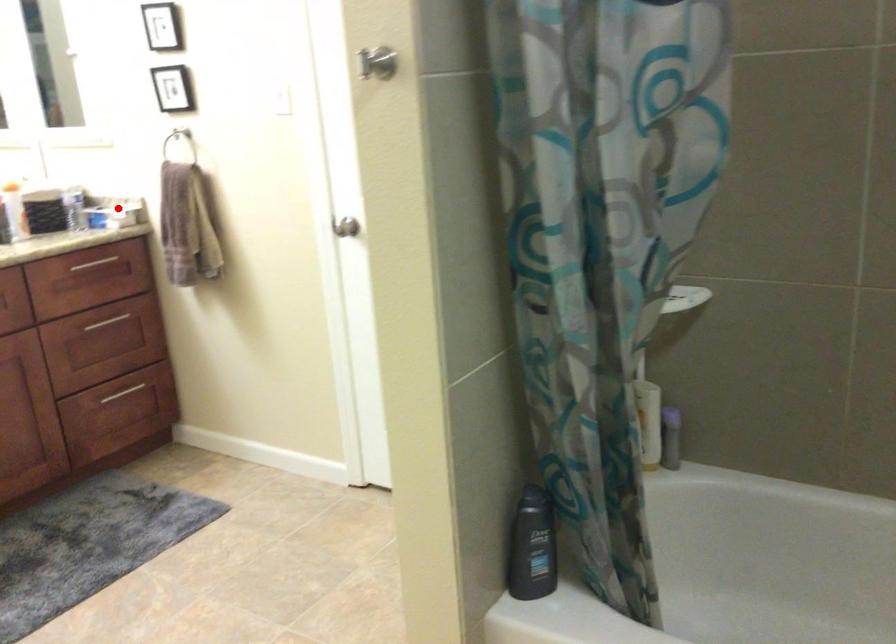
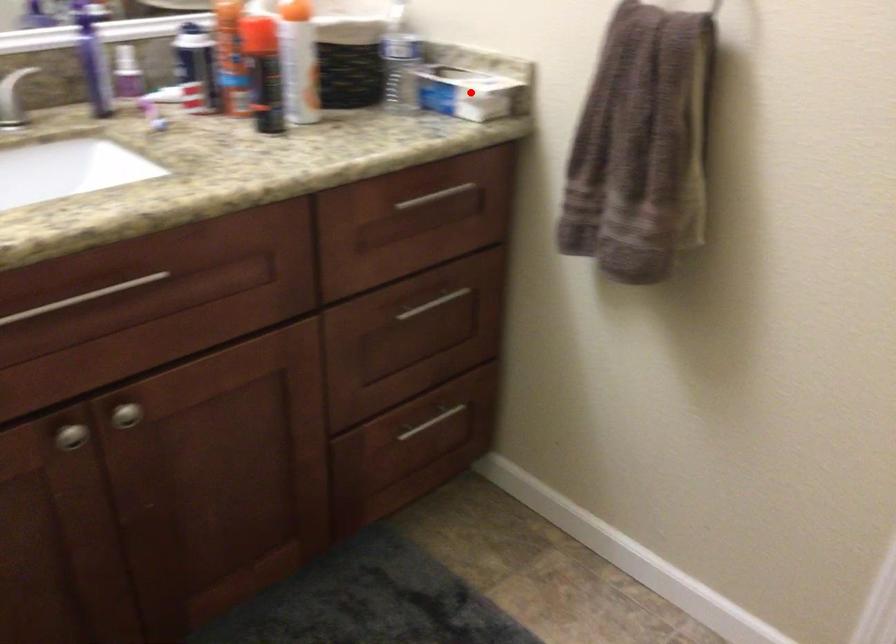
I am providing you with two images of the same scene from different viewpoints. A red point is marked on the first image and another point is marked on the second image. Is the red point in image1 aligned with the point shown in image2?

Yes